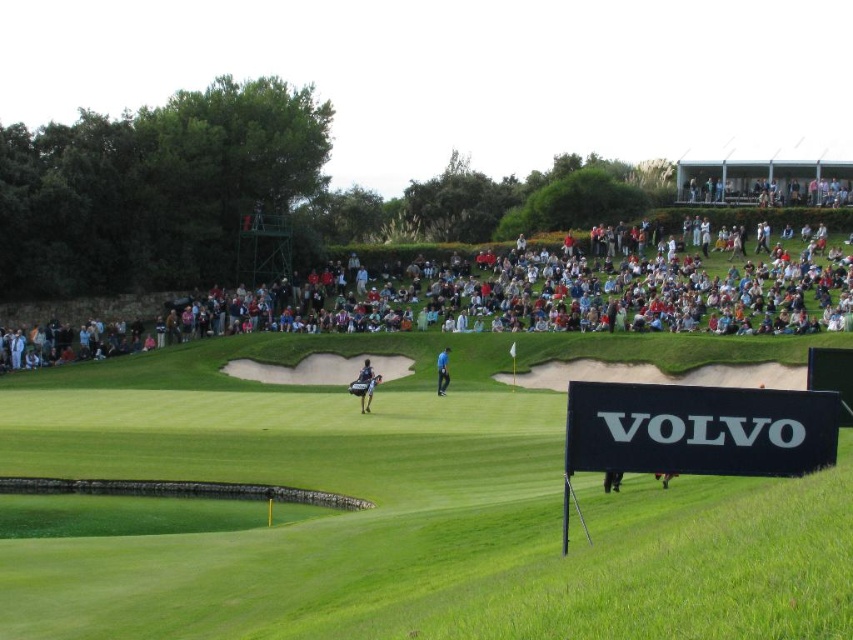
Question: Can you confirm if multicolored fabric crowd at upper center is smaller than black plastic sign at lower right?

Choices:
 (A) no
 (B) yes

Answer: (A)

Question: Which point is farther from the camera taking this photo?

Choices:
 (A) 721,400
 (B) 465,566
 (C) 624,269

Answer: (C)

Question: Does green grass at center have a lesser width compared to blue fabric golf shirt at center?

Choices:
 (A) yes
 (B) no

Answer: (B)

Question: Can you confirm if black plastic sign at lower right is smaller than dark blue fabric golf bag at center?

Choices:
 (A) no
 (B) yes

Answer: (B)

Question: Among these points, which one is farthest from the camera?

Choices:
 (A) (688, 440)
 (B) (370, 390)
 (C) (437, 362)

Answer: (C)

Question: Which point is farther from the camera taking this photo?

Choices:
 (A) (370, 397)
 (B) (584, 339)
 (C) (682, 445)

Answer: (B)